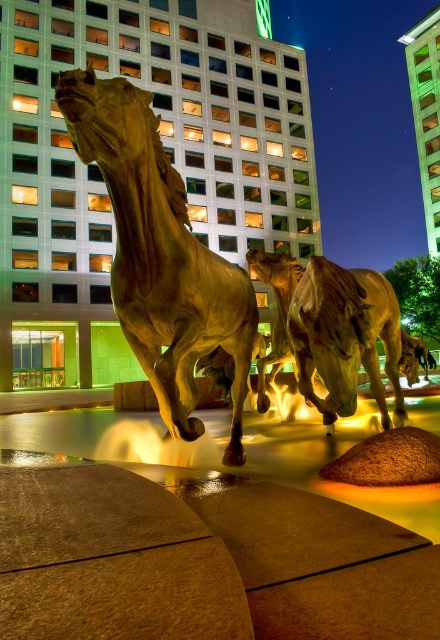
Question: Does gold polished horse at center lie behind shiny bronze horse at center?

Choices:
 (A) no
 (B) yes

Answer: (A)

Question: Is gold polished horse at center above shiny bronze horse at center?

Choices:
 (A) yes
 (B) no

Answer: (A)

Question: Which of the following is the closest to the observer?

Choices:
 (A) shiny bronze horse at center
 (B) gold polished horse at center

Answer: (B)

Question: Which point appears farthest from the camera in this image?

Choices:
 (A) (308, 387)
 (B) (77, 131)

Answer: (A)

Question: Where is gold polished horse at center located in relation to shiny bronze horse at center in the image?

Choices:
 (A) left
 (B) right

Answer: (A)